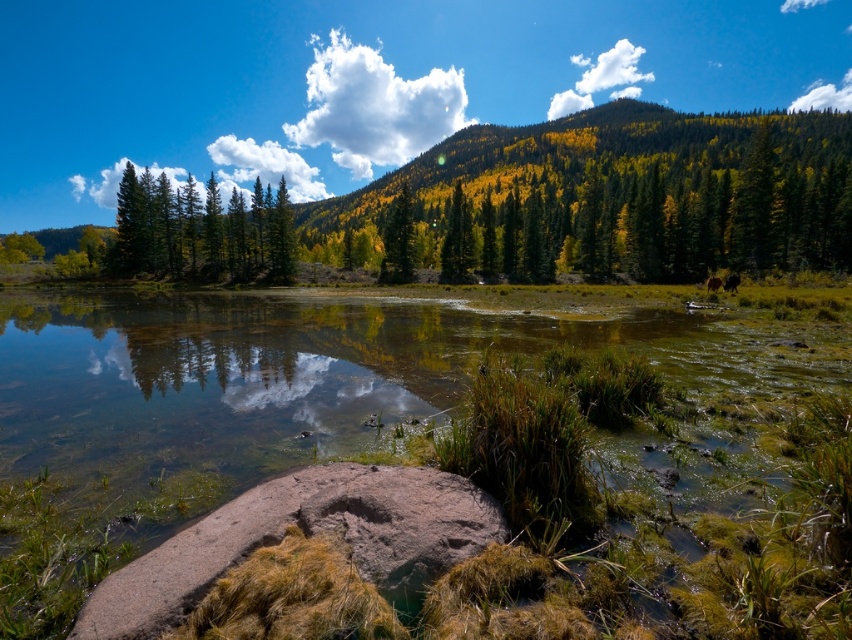
Question: Among these objects, which one is farthest from the camera?

Choices:
 (A) brown furry dog at lower right
 (B) golden-green foliage at upper center

Answer: (B)

Question: Does brown rough rock at center appear under green matte trees at left?

Choices:
 (A) yes
 (B) no

Answer: (A)

Question: Does green matte trees at left have a smaller size compared to green matte tree at center?

Choices:
 (A) no
 (B) yes

Answer: (A)

Question: Can you confirm if brown rough rock at center is bigger than green matte tree at center?

Choices:
 (A) yes
 (B) no

Answer: (B)

Question: Among these objects, which one is farthest from the camera?

Choices:
 (A) brown furry bear at right
 (B) clear water at center

Answer: (A)

Question: Estimate the real-world distances between objects in this image. Which object is closer to the golden-green foliage at upper center?

Choices:
 (A) yellow-green foliage at center
 (B) brown furry bear at right

Answer: (A)